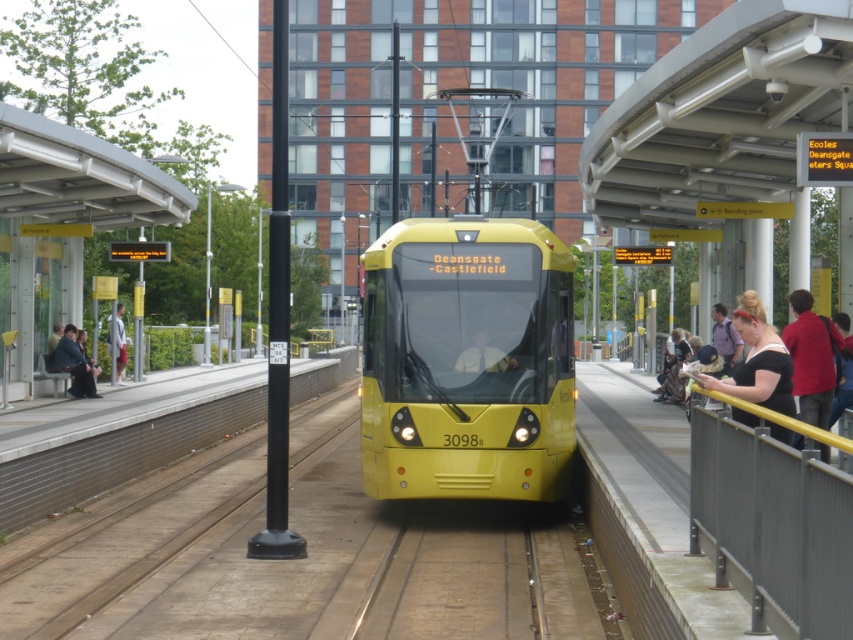
You are a passenger waiting at the tram station. You notice a person with black fabric hair at right and another wearing a red cotton shirt at right. Which of these two items is closer to the ground?

The black fabric hair at right is shorter than the red cotton shirt at right, so the black fabric hair at right is closer to the ground.

You are a photographer at the tram station. You want to take a photo of the red cotton shirt at right and the dark blue fabric jacket at left. Which clothing item appears bigger in your photo?

The red cotton shirt at right appears bigger in the photo because it is larger in size than the dark blue fabric jacket at left.

You are a passenger waiting at the tram station. You notice a person wearing a red cotton shirt at right and another wearing a dark blue fabric jacket at left. Which piece of clothing is higher in position?

The red cotton shirt at right is above the dark blue fabric jacket at left.